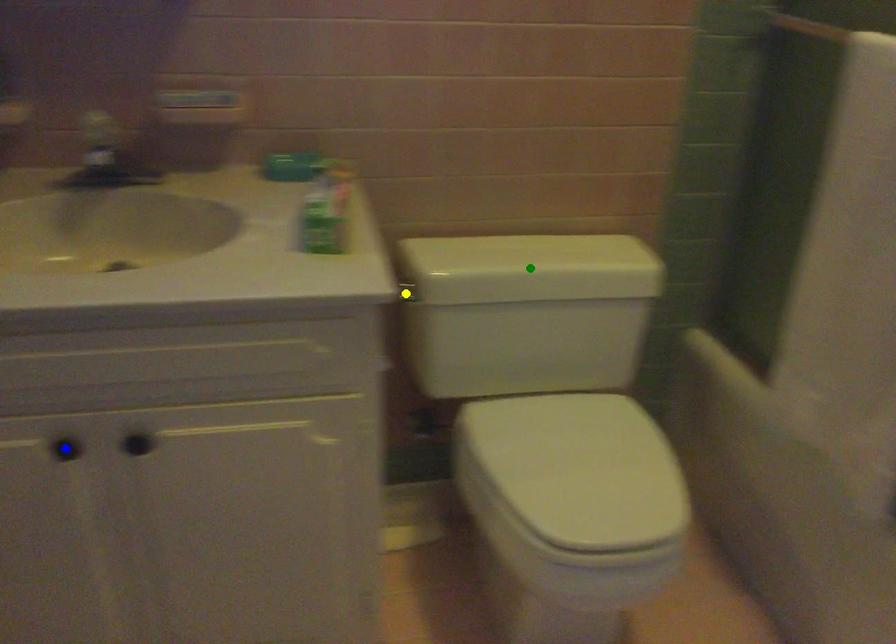
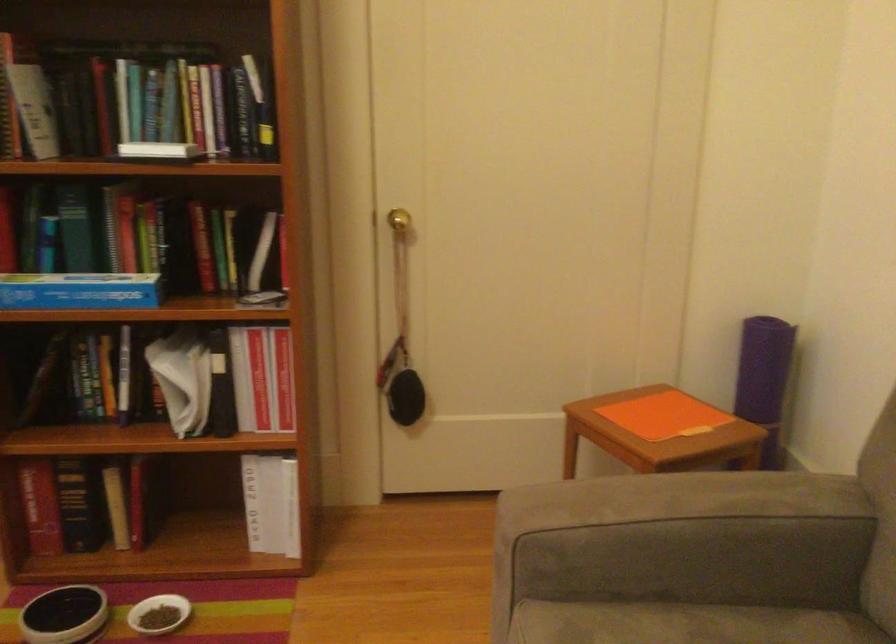
I am providing you with two images of the same scene from different viewpoints. Three points are marked in image1. Which point corresponds to a part or object that is occluded in image2?In image1, three points are marked. Which of them correspond to a part or object that is occluded in image2?Among the three points shown in image1, which one corresponds to a part or object that is no longer visible due to occlusion in image2?

blue point, green point, yellow point